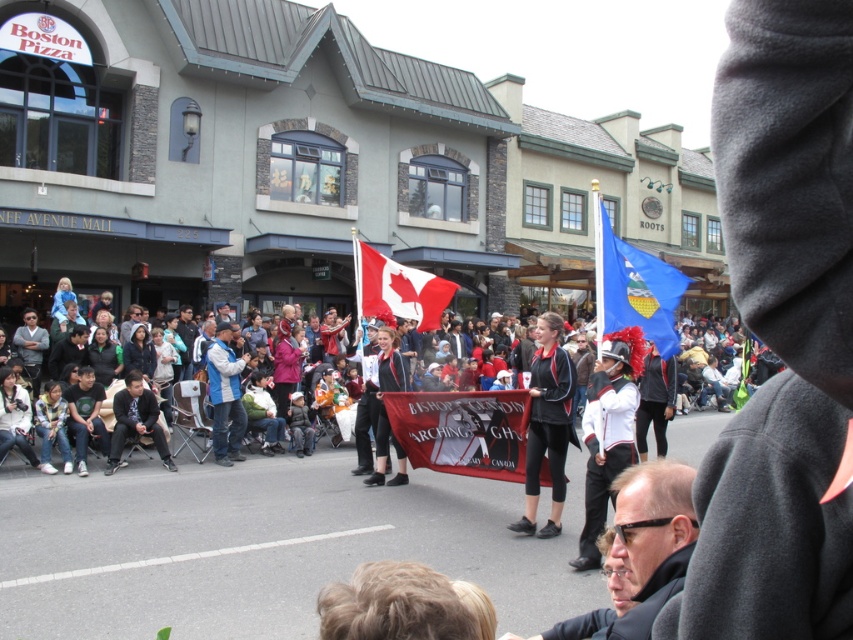
Question: Can you confirm if matte black sunglasses at lower right is positioned to the right of blue denim jeans at center?

Choices:
 (A) yes
 (B) no

Answer: (A)

Question: Is the position of matte black sunglasses at lower right more distant than that of blue denim jeans at center?

Choices:
 (A) no
 (B) yes

Answer: (A)

Question: Which is nearer to the blue fabric flag at center?

Choices:
 (A) matte black jacket at center
 (B) red fabric flag at center

Answer: (B)

Question: Can you confirm if black leather jacket at center is bigger than blue denim jeans at center?

Choices:
 (A) no
 (B) yes

Answer: (A)

Question: Which of these objects is positioned closest to the matte black jacket at center?

Choices:
 (A) red fabric flag at center
 (B) matte black sunglasses at lower right
 (C) black leather jacket at center
 (D) blue fabric flag at center

Answer: (D)

Question: Which object is the closest to the blue fabric flag at center?

Choices:
 (A) matte black jacket at center
 (B) blue denim jeans at center
 (C) red fabric flag at center

Answer: (C)